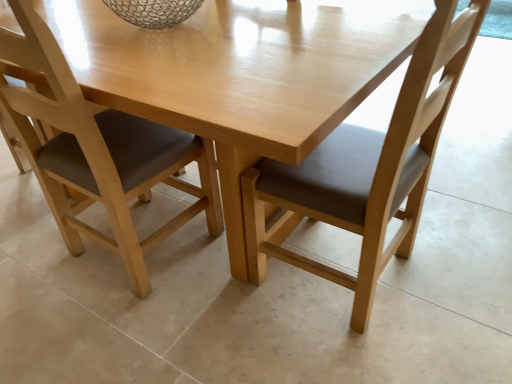
The height and width of the screenshot is (384, 512). I want to click on matte wood chair at lower left, the first chair from the left, so click(99, 151).

Is matte wood chair at lower left, the first chair from the left, far away from matte wood chair at center, the 1th chair from the right?

They are positioned close to each other.

Measure the distance from matte wood chair at lower left, positioned as the 2th chair in right-to-left order, to matte wood chair at center, the 1th chair from the right.

They are 52.68 centimeters apart.

From a real-world perspective, is matte wood chair at lower left, the first chair from the left, located beneath matte wood chair at center, the second chair positioned from the left?

Yes, from a real-world perspective, matte wood chair at lower left, the first chair from the left, is under matte wood chair at center, the second chair positioned from the left.

Based on their sizes in the image, would you say matte wood chair at lower left, positioned as the 2th chair in right-to-left order, is bigger or smaller than matte wood chair at center, the second chair positioned from the left?

matte wood chair at lower left, positioned as the 2th chair in right-to-left order, is smaller than matte wood chair at center, the second chair positioned from the left.

Is matte wood chair at center, the 1th chair from the right, facing towards light wood table at center?

Yes, matte wood chair at center, the 1th chair from the right, is facing light wood table at center.

How different are the orientations of matte wood chair at center, the second chair positioned from the left, and light wood table at center in degrees?

The angle between the facing direction of matte wood chair at center, the second chair positioned from the left, and the facing direction of light wood table at center is 87.2 degrees.

Is matte wood chair at center, the 1th chair from the right, next to light wood table at center and touching it?

No, matte wood chair at center, the 1th chair from the right, is not in contact with light wood table at center.

From a real-world perspective, relative to light wood table at center, is matte wood chair at center, the 1th chair from the right, vertically above or below?

Clearly, from a real-world perspective, matte wood chair at center, the 1th chair from the right, is above light wood table at center.

Could matte wood chair at center, the 1th chair from the right, be considered to be inside light wood table at center?

Yes, matte wood chair at center, the 1th chair from the right, is a part of light wood table at center.

In the scene shown: Can you confirm if light wood table at center is smaller than matte wood chair at center, the 1th chair from the right?

No, light wood table at center is not smaller than matte wood chair at center, the 1th chair from the right.

Is the depth of light wood table at center greater than that of matte wood chair at center, the 1th chair from the right?

Yes, the depth of light wood table at center is greater than that of matte wood chair at center, the 1th chair from the right.

Is point (359, 300) closer to viewer compared to point (157, 154)?

Yes, point (359, 300) is closer to viewer.

Who is taller, matte wood chair at center, the 1th chair from the right, or matte wood chair at lower left, the first chair from the left?

matte wood chair at center, the 1th chair from the right, is taller.

Can you confirm if matte wood chair at center, the 1th chair from the right, is thinner than matte wood chair at lower left, positioned as the 2th chair in right-to-left order?

Yes, matte wood chair at center, the 1th chair from the right, is thinner than matte wood chair at lower left, positioned as the 2th chair in right-to-left order.

Is light wood table at center turned away from matte wood chair at lower left, positioned as the 2th chair in right-to-left order?

Correct, light wood table at center is looking away from matte wood chair at lower left, positioned as the 2th chair in right-to-left order.

Considering the positions of objects light wood table at center and matte wood chair at lower left, positioned as the 2th chair in right-to-left order, in the image provided, who is in front, light wood table at center or matte wood chair at lower left, positioned as the 2th chair in right-to-left order,?

light wood table at center.

From a real-world perspective, which chair is the 1st one above the light wood table at center? Please provide its 2D coordinates.

[(99, 151)]

Is matte wood chair at lower left, the first chair from the left, in front of light wood table at center?

No, it is not.

Find the location of a particular element. This screenshot has width=512, height=384. chair to the left of light wood table at center is located at coordinates (99, 151).

From a real-world perspective, is matte wood chair at lower left, positioned as the 2th chair in right-to-left order, positioned above or below light wood table at center?

From a real-world perspective, matte wood chair at lower left, positioned as the 2th chair in right-to-left order, is physically above light wood table at center.

Is matte wood chair at lower left, the first chair from the left, facing away from light wood table at center?

Yes, matte wood chair at lower left, the first chair from the left,'s orientation is away from light wood table at center.

Find the location of a particular element. The image size is (512, 384). chair above the matte wood chair at lower left, positioned as the 2th chair in right-to-left order (from a real-world perspective) is located at coordinates (367, 168).

Image resolution: width=512 pixels, height=384 pixels. Find the location of `round table on the left of matte wood chair at center, the second chair positioned from the left`. round table on the left of matte wood chair at center, the second chair positioned from the left is located at coordinates (239, 75).

Based on their spatial positions, is matte wood chair at center, the 1th chair from the right, or light wood table at center closer to matte wood chair at lower left, positioned as the 2th chair in right-to-left order?

light wood table at center is positioned closer to the anchor matte wood chair at lower left, positioned as the 2th chair in right-to-left order.

Considering their positions, is matte wood chair at center, the second chair positioned from the left, positioned further to light wood table at center than matte wood chair at lower left, positioned as the 2th chair in right-to-left order?

matte wood chair at lower left, positioned as the 2th chair in right-to-left order, lies further to light wood table at center than the other object.

Looking at the image, which one is located further to matte wood chair at lower left, positioned as the 2th chair in right-to-left order, light wood table at center or matte wood chair at center, the second chair positioned from the left?

matte wood chair at center, the second chair positioned from the left.

Considering their positions, is matte wood chair at lower left, positioned as the 2th chair in right-to-left order, positioned closer to light wood table at center than matte wood chair at center, the second chair positioned from the left?

matte wood chair at center, the second chair positioned from the left.

Considering their positions, is matte wood chair at lower left, the first chair from the left, positioned closer to matte wood chair at center, the 1th chair from the right, than light wood table at center?

The object closer to matte wood chair at center, the 1th chair from the right, is light wood table at center.

Considering their positions, is light wood table at center positioned closer to matte wood chair at center, the second chair positioned from the left, than matte wood chair at lower left, the first chair from the left?

light wood table at center lies closer to matte wood chair at center, the second chair positioned from the left, than the other object.

Image resolution: width=512 pixels, height=384 pixels. Find the location of `round table situated between matte wood chair at lower left, the first chair from the left, and matte wood chair at center, the second chair positioned from the left, from left to right`. round table situated between matte wood chair at lower left, the first chair from the left, and matte wood chair at center, the second chair positioned from the left, from left to right is located at coordinates (239, 75).